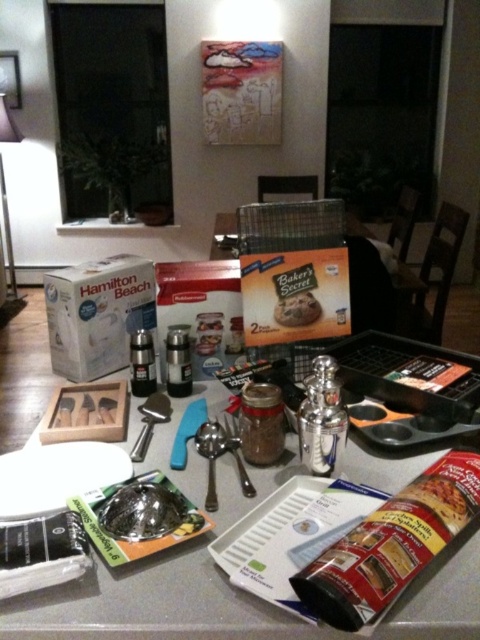
You are a baker who needs to place the baked chocolate chip cookie at center onto the white cardboard hamilton beach at center. Is the cookie smaller than the cardboard?

A: The white cardboard hamilton beach at center is bigger than baked chocolate chip cookie at center, so yes, the cookie is smaller and can fit on the cardboard.

You are trying to place a new cookie on the table. The cookie is the same size as the baked chocolate chip cookie at center. Is there enough space next to the white cardboard hamilton beach at center to fit the new cookie without overlapping?

The white cardboard hamilton beach at center is wider than the baked chocolate chip cookie at center. Since the new cookie is the same size as the existing one, there should be sufficient space next to the white cardboard hamilton beach at center to place the new cookie without overlapping.

You are a chef trying to reach the metallic silver spatula at center from the white cardboard hamilton beach at center. Can you grab it without moving any other items? The minimum distance required to reach without moving items is 8 inches.

The white cardboard hamilton beach at center is 8.81 inches from the metallic silver spatula at center. Since the distance is more than 8 inches, you can grab the metallic silver spatula at center without moving other items.